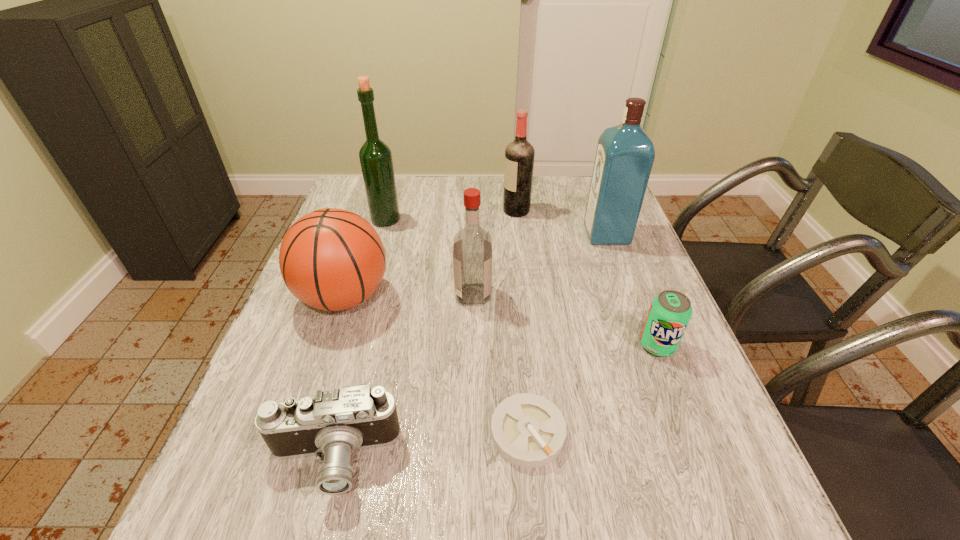
Identify the location of liquor that is at the left edge. The width and height of the screenshot is (960, 540). (375, 156).

Find the location of a particular element. The height and width of the screenshot is (540, 960). basketball at the left edge is located at coordinates (331, 259).

Find the location of `camera at the left edge`. camera at the left edge is located at coordinates (334, 423).

This screenshot has width=960, height=540. Find the location of `liquor at the right edge`. liquor at the right edge is located at coordinates (625, 154).

At what (x,y) coordinates should I click in order to perform the action: click on pop soda at the right edge. Please return your answer as a coordinate pair (x, y). The height and width of the screenshot is (540, 960). Looking at the image, I should click on (670, 312).

At what (x,y) coordinates should I click in order to perform the action: click on object that is at the far left corner. Please return your answer as a coordinate pair (x, y). The width and height of the screenshot is (960, 540). Looking at the image, I should click on (375, 156).

Locate an element on the screen. The height and width of the screenshot is (540, 960). object located in the near left corner section of the desktop is located at coordinates (334, 423).

Image resolution: width=960 pixels, height=540 pixels. I want to click on vacant region at the far edge of the desktop, so click(439, 201).

Find the location of a particular element. vacant space at the near edge of the desktop is located at coordinates (450, 496).

The height and width of the screenshot is (540, 960). In the image, there is a desktop. Identify the location of free space at the left edge. (x=341, y=326).